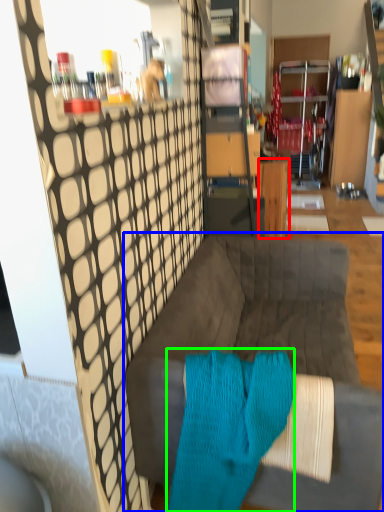
Question: Based on their relative distances, which object is farther from table (highlighted by a red box)? Choose from studio couch (highlighted by a blue box) and aqua (highlighted by a green box).

Choices:
 (A) studio couch
 (B) aqua

Answer: (B)